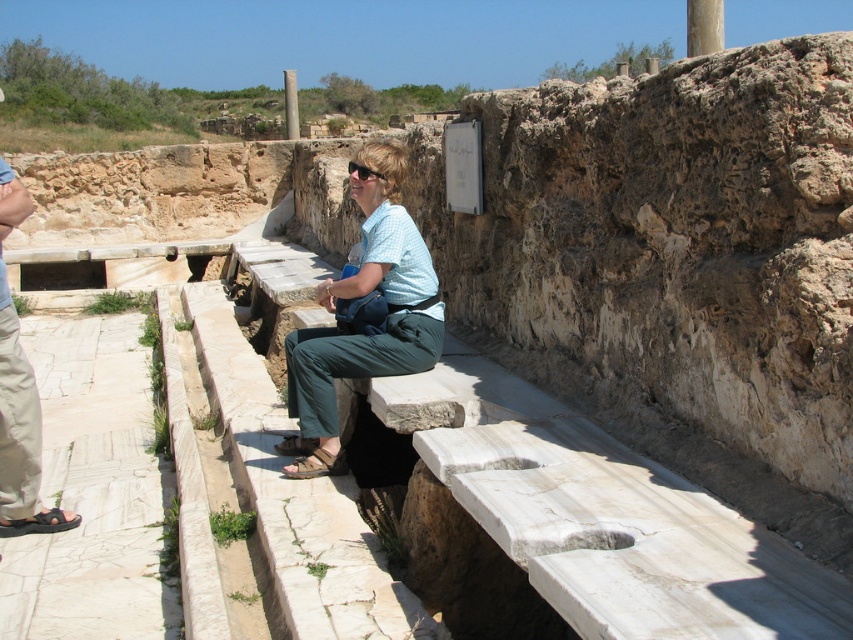
Is green fabric pants at center thinner than beige cotton pants at lower left?

No, green fabric pants at center is not thinner than beige cotton pants at lower left.

Which is more to the right, green fabric pants at center or beige cotton pants at lower left?

green fabric pants at center

The height and width of the screenshot is (640, 853). What do you see at coordinates (360, 298) in the screenshot?
I see `green fabric pants at center` at bounding box center [360, 298].

You are a GUI agent. You are given a task and a screenshot of the screen. Output one action in this format:
    pyautogui.click(x=<x>, y=<y>)
    Task: Click on the green fabric pants at center
    Image resolution: width=853 pixels, height=640 pixels.
    Given the screenshot: What is the action you would take?
    pyautogui.click(x=360, y=298)